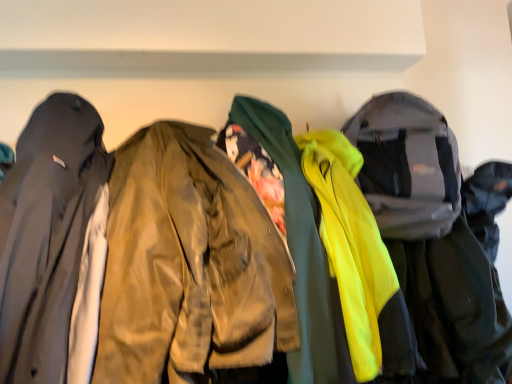
Locate an element on the screen. The height and width of the screenshot is (384, 512). matte olive green jacket at center, the second jacket in the left-to-right sequence is located at coordinates pyautogui.click(x=189, y=263).

At what (x,y) coordinates should I click in order to perform the action: click on matte olive green jacket at center, placed as the 2th jacket when sorted from right to left. Please return your answer as a coordinate pair (x, y). This screenshot has height=384, width=512. Looking at the image, I should click on pyautogui.click(x=189, y=263).

Looking at this image, from a real-world perspective, is matte black jacket at left, the 1th jacket when ordered from left to right, positioned above or below matte olive green jacket at center, placed as the 2th jacket when sorted from right to left?

From a real-world perspective, matte black jacket at left, the 1th jacket when ordered from left to right, is physically above matte olive green jacket at center, placed as the 2th jacket when sorted from right to left.

Does matte black jacket at left, which is counted as the 3th jacket, starting from the right, turn towards matte olive green jacket at center, the second jacket in the left-to-right sequence?

No, matte black jacket at left, which is counted as the 3th jacket, starting from the right, is not turned towards matte olive green jacket at center, the second jacket in the left-to-right sequence.

Considering the sizes of objects matte black jacket at left, the 1th jacket when ordered from left to right, and matte olive green jacket at center, placed as the 2th jacket when sorted from right to left, in the image provided, who is smaller, matte black jacket at left, the 1th jacket when ordered from left to right, or matte olive green jacket at center, placed as the 2th jacket when sorted from right to left,?

With smaller size is matte black jacket at left, the 1th jacket when ordered from left to right.

How different are the orientations of matte black jacket at left, the 1th jacket when ordered from left to right, and matte olive green jacket at center, placed as the 2th jacket when sorted from right to left, in degrees?

The angular difference between matte black jacket at left, the 1th jacket when ordered from left to right, and matte olive green jacket at center, placed as the 2th jacket when sorted from right to left, is 0.000128 degrees.

From the image's perspective, is neon yellow fabric jacket at right, the third jacket viewed from the left, on matte olive green jacket at center, placed as the 2th jacket when sorted from right to left?

Correct, neon yellow fabric jacket at right, the third jacket viewed from the left, appears higher than matte olive green jacket at center, placed as the 2th jacket when sorted from right to left, in the image.

From a real-world perspective, which object stands above the other?

In real-world perspective, matte olive green jacket at center, placed as the 2th jacket when sorted from right to left, is above.

Would you say neon yellow fabric jacket at right, the third jacket viewed from the left, is inside or outside matte olive green jacket at center, placed as the 2th jacket when sorted from right to left?

neon yellow fabric jacket at right, the third jacket viewed from the left, is outside matte olive green jacket at center, placed as the 2th jacket when sorted from right to left.

Can you confirm if matte olive green jacket at center, the second jacket in the left-to-right sequence, is thinner than neon yellow fabric jacket at right, the third jacket viewed from the left?

In fact, matte olive green jacket at center, the second jacket in the left-to-right sequence, might be wider than neon yellow fabric jacket at right, the third jacket viewed from the left.

Does point (272, 358) come farther from viewer compared to point (483, 279)?

No, (272, 358) is in front of (483, 279).

From the image's perspective, which is below, matte olive green jacket at center, placed as the 2th jacket when sorted from right to left, or neon yellow fabric jacket at right, acting as the 1th jacket starting from the right?

matte olive green jacket at center, placed as the 2th jacket when sorted from right to left, appears lower in the image.

Who is taller, matte olive green jacket at center, the second jacket in the left-to-right sequence, or neon yellow fabric jacket at right, the third jacket viewed from the left?

neon yellow fabric jacket at right, the third jacket viewed from the left, is taller.

Which is behind, matte black jacket at left, which is counted as the 3th jacket, starting from the right, or neon yellow fabric jacket at right, acting as the 1th jacket starting from the right?

neon yellow fabric jacket at right, acting as the 1th jacket starting from the right.

Does matte black jacket at left, which is counted as the 3th jacket, starting from the right, have a lesser width compared to neon yellow fabric jacket at right, acting as the 1th jacket starting from the right?

In fact, matte black jacket at left, which is counted as the 3th jacket, starting from the right, might be wider than neon yellow fabric jacket at right, acting as the 1th jacket starting from the right.

How many degrees apart are the facing directions of matte black jacket at left, which is counted as the 3th jacket, starting from the right, and neon yellow fabric jacket at right, acting as the 1th jacket starting from the right?

matte black jacket at left, which is counted as the 3th jacket, starting from the right, and neon yellow fabric jacket at right, acting as the 1th jacket starting from the right, are facing 0.00171 degrees away from each other.

Could you measure the distance between matte black jacket at left, the 1th jacket when ordered from left to right, and neon yellow fabric jacket at right, the third jacket viewed from the left?

matte black jacket at left, the 1th jacket when ordered from left to right, and neon yellow fabric jacket at right, the third jacket viewed from the left, are 30.75 inches apart from each other.

Considering the relative positions of matte olive green jacket at center, placed as the 2th jacket when sorted from right to left, and matte black jacket at left, the 1th jacket when ordered from left to right, in the image provided, is matte olive green jacket at center, placed as the 2th jacket when sorted from right to left, to the left or to the right of matte black jacket at left, the 1th jacket when ordered from left to right,?

In the image, matte olive green jacket at center, placed as the 2th jacket when sorted from right to left, appears on the right side of matte black jacket at left, the 1th jacket when ordered from left to right.

From a real-world perspective, between matte olive green jacket at center, the second jacket in the left-to-right sequence, and matte black jacket at left, which is counted as the 3th jacket, starting from the right, who is vertically lower?

matte olive green jacket at center, the second jacket in the left-to-right sequence, is physically lower.

The width and height of the screenshot is (512, 384). Identify the location of jacket on the left of matte olive green jacket at center, placed as the 2th jacket when sorted from right to left. (52, 241).

What's the angular difference between neon yellow fabric jacket at right, the third jacket viewed from the left, and matte black jacket at left, the 1th jacket when ordered from left to right,'s facing directions?

The angle between the facing direction of neon yellow fabric jacket at right, the third jacket viewed from the left, and the facing direction of matte black jacket at left, the 1th jacket when ordered from left to right, is 0.00171 degrees.

Considering the positions of points (424, 159) and (81, 157), is point (424, 159) closer to camera compared to point (81, 157)?

That is False.

Considering the positions of objects neon yellow fabric jacket at right, acting as the 1th jacket starting from the right, and matte black jacket at left, which is counted as the 3th jacket, starting from the right, in the image provided, who is more to the left, neon yellow fabric jacket at right, acting as the 1th jacket starting from the right, or matte black jacket at left, which is counted as the 3th jacket, starting from the right,?

matte black jacket at left, which is counted as the 3th jacket, starting from the right.

Consider the image. From the image's perspective, is neon yellow fabric jacket at right, the third jacket viewed from the left, on top of matte black jacket at left, the 1th jacket when ordered from left to right?

No, from the image's perspective, neon yellow fabric jacket at right, the third jacket viewed from the left, is not on top of matte black jacket at left, the 1th jacket when ordered from left to right.

Image resolution: width=512 pixels, height=384 pixels. I want to click on the 2nd jacket above when counting from the matte olive green jacket at center, the second jacket in the left-to-right sequence (from the image's perspective), so click(x=52, y=241).

I want to click on jacket below the neon yellow fabric jacket at right, the third jacket viewed from the left (from the image's perspective), so pos(189,263).

When comparing their distances from matte black jacket at left, the 1th jacket when ordered from left to right, does matte olive green jacket at center, placed as the 2th jacket when sorted from right to left, or neon yellow fabric jacket at right, the third jacket viewed from the left, seem further?

neon yellow fabric jacket at right, the third jacket viewed from the left, is further to matte black jacket at left, the 1th jacket when ordered from left to right.

Looking at the image, which one is located closer to matte olive green jacket at center, the second jacket in the left-to-right sequence, matte black jacket at left, the 1th jacket when ordered from left to right, or neon yellow fabric jacket at right, acting as the 1th jacket starting from the right?

The object closer to matte olive green jacket at center, the second jacket in the left-to-right sequence, is matte black jacket at left, the 1th jacket when ordered from left to right.

Considering their positions, is matte olive green jacket at center, the second jacket in the left-to-right sequence, positioned further to neon yellow fabric jacket at right, the third jacket viewed from the left, than matte black jacket at left, the 1th jacket when ordered from left to right?

matte black jacket at left, the 1th jacket when ordered from left to right, is further to neon yellow fabric jacket at right, the third jacket viewed from the left.

Looking at the image, which one is located further to neon yellow fabric jacket at right, acting as the 1th jacket starting from the right, matte black jacket at left, which is counted as the 3th jacket, starting from the right, or matte olive green jacket at center, placed as the 2th jacket when sorted from right to left?

matte black jacket at left, which is counted as the 3th jacket, starting from the right, is positioned further to the anchor neon yellow fabric jacket at right, acting as the 1th jacket starting from the right.

Which object lies nearer to the anchor point matte black jacket at left, the 1th jacket when ordered from left to right, neon yellow fabric jacket at right, the third jacket viewed from the left, or matte olive green jacket at center, placed as the 2th jacket when sorted from right to left?

matte olive green jacket at center, placed as the 2th jacket when sorted from right to left, lies closer to matte black jacket at left, the 1th jacket when ordered from left to right, than the other object.

When comparing their distances from matte olive green jacket at center, placed as the 2th jacket when sorted from right to left, does neon yellow fabric jacket at right, the third jacket viewed from the left, or matte black jacket at left, which is counted as the 3th jacket, starting from the right, seem closer?

Based on the image, matte black jacket at left, which is counted as the 3th jacket, starting from the right, appears to be nearer to matte olive green jacket at center, placed as the 2th jacket when sorted from right to left.

In order to click on jacket between matte black jacket at left, which is counted as the 3th jacket, starting from the right, and neon yellow fabric jacket at right, acting as the 1th jacket starting from the right in this screenshot , I will do `click(189, 263)`.